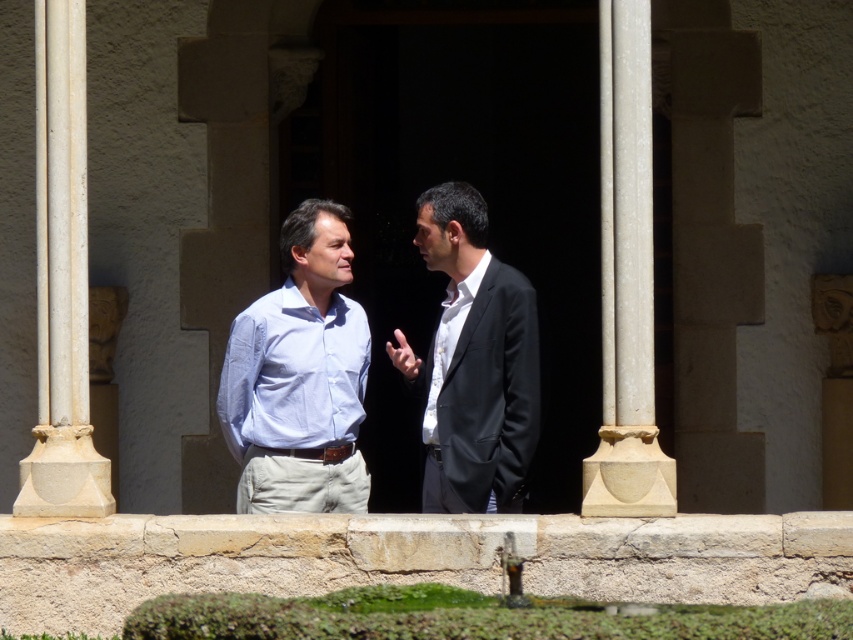
Looking at this image, who is higher up, light blue cotton shirt at center or white cotton shirt at center?

light blue cotton shirt at center is higher up.

Looking at this image, who is lower down, light blue cotton shirt at center or white cotton shirt at center?

white cotton shirt at center

Does point (289, 252) come farther from viewer compared to point (439, 353)?

Yes, point (289, 252) is behind point (439, 353).

In order to click on light blue cotton shirt at center in this screenshot , I will do `click(299, 376)`.

Is matte black suit at center positioned before white cotton shirt at center?

Yes, matte black suit at center is in front of white cotton shirt at center.

The image size is (853, 640). I want to click on matte black suit at center, so click(473, 362).

Identify the location of matte black suit at center. click(473, 362).

What do you see at coordinates (625, 280) in the screenshot? The height and width of the screenshot is (640, 853). I see `white stone column at right` at bounding box center [625, 280].

Can you confirm if white stone column at right is taller than white cotton shirt at center?

Correct, white stone column at right is much taller as white cotton shirt at center.

Is point (628, 259) positioned in front of point (439, 364)?

That is True.

You are a GUI agent. You are given a task and a screenshot of the screen. Output one action in this format:
    pyautogui.click(x=<x>, y=<y>)
    Task: Click on the white stone column at right
    This screenshot has height=640, width=853.
    Given the screenshot: What is the action you would take?
    pyautogui.click(x=625, y=280)